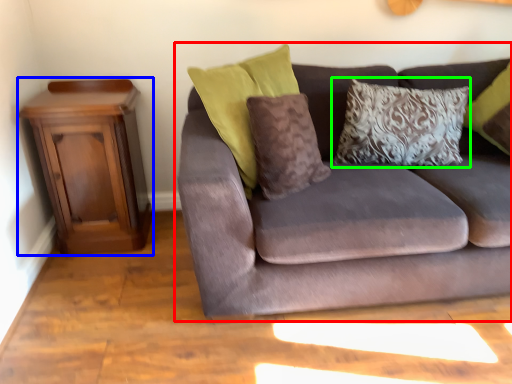
Question: Which object is positioned closest to studio couch (highlighted by a red box)? Select from nightstand (highlighted by a blue box) and pillow (highlighted by a green box).

Choices:
 (A) nightstand
 (B) pillow

Answer: (B)